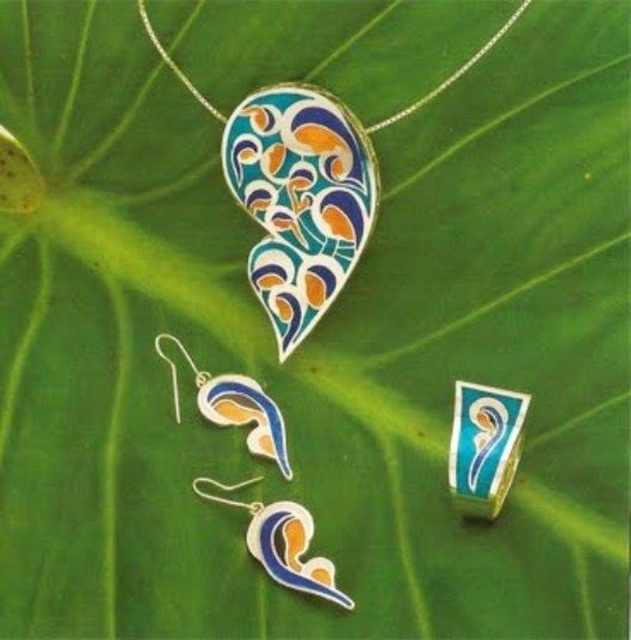
You are a jeweler examining the jewelry display. You need to determine which piece is larger between the blue enamel ring at center and the enamel pendant at upper center. Which one is bigger?

The enamel pendant at upper center is larger than the blue enamel ring at center.

You are a jeweler examining the jewelry pieces displayed against a vibrant green leaf background. You need to determine which of the two items, the matte enamel earring at lower center or the enamel pendant at upper center, is shorter in height. Which one is shorter?

The matte enamel earring at lower center has a lesser height compared to the enamel pendant at upper center, so the matte enamel earring at lower center is shorter.

You are an appraiser examining the jewelry display. The display has a coordinate system where the bottom left corner is the origin point. The appraiser needs to locate the matte enamel earring at lower center. What are its coordinates?

The coordinates of the matte enamel earring at lower center are at point (281, 541).